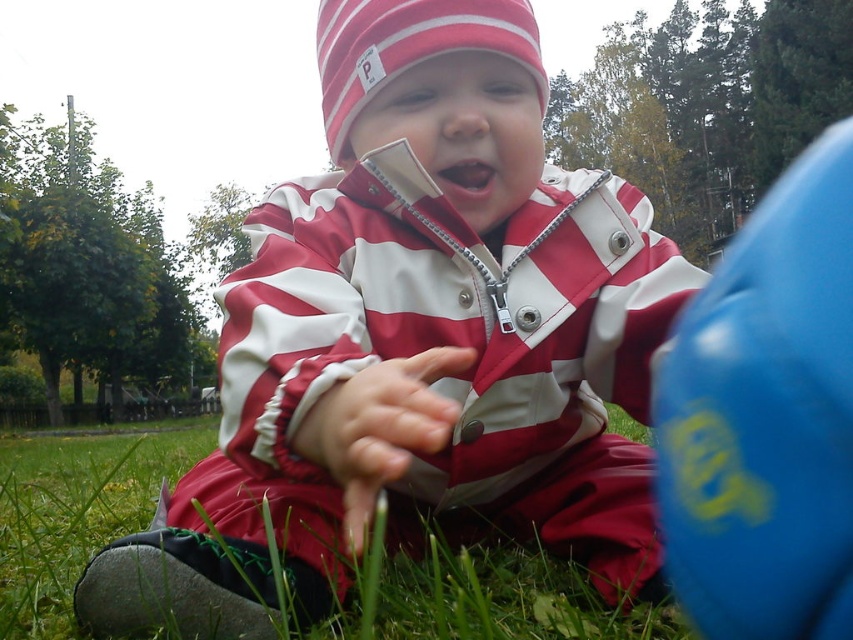
You are a parent holding a 1.2 meter long umbrella. You want to shield the child from the rain while keeping the blue rubber ball at right dry. Can you position the umbrella so that both the child and the ball are under its cover without overlapping the green grass at lower center?

The distance between the blue rubber ball at right and green grass at lower center is 1.15 meters. Since the umbrella is 1.2 meters long, it can cover both the ball and the child while avoiding the grass.